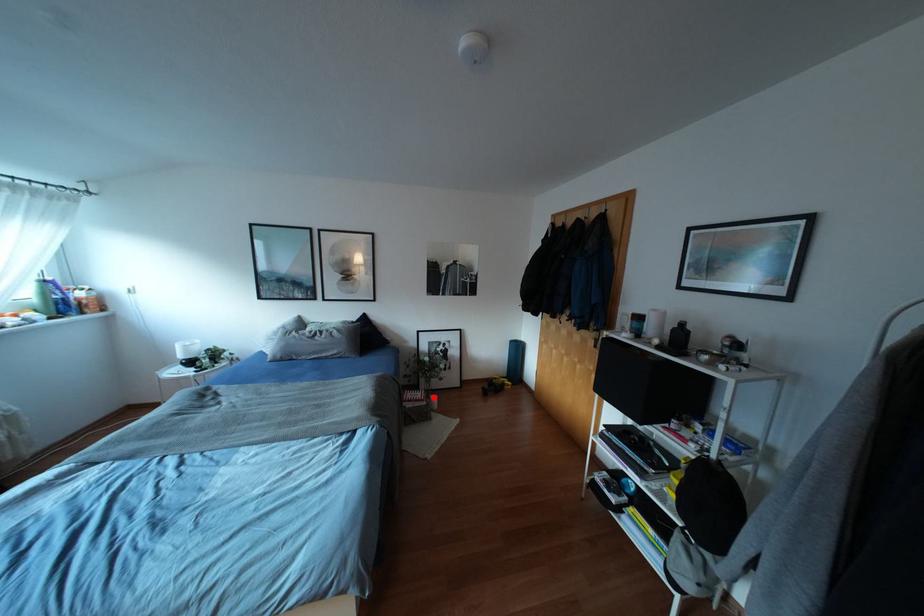
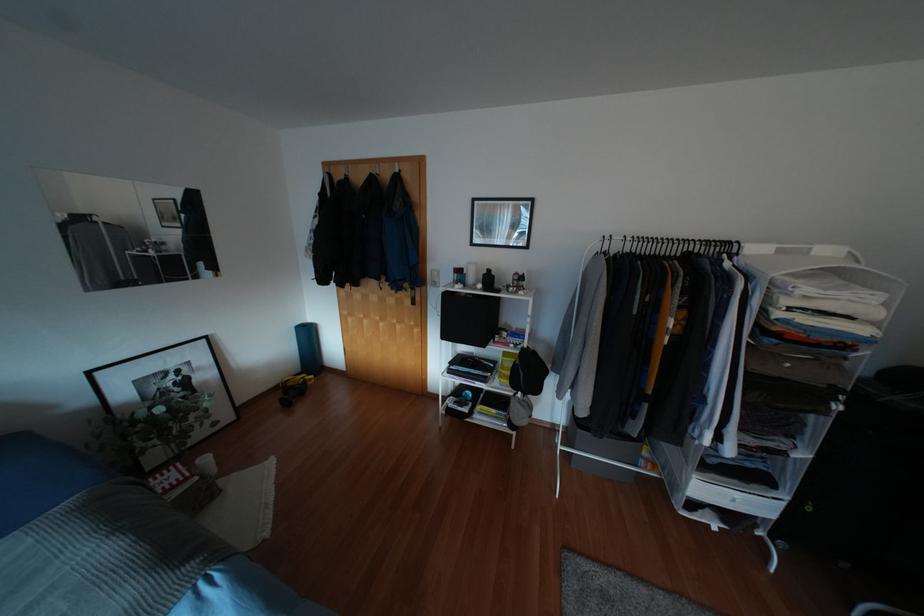
The point at the highlighted location is marked in the first image. Where is the corresponding point in the second image?

(205, 459)